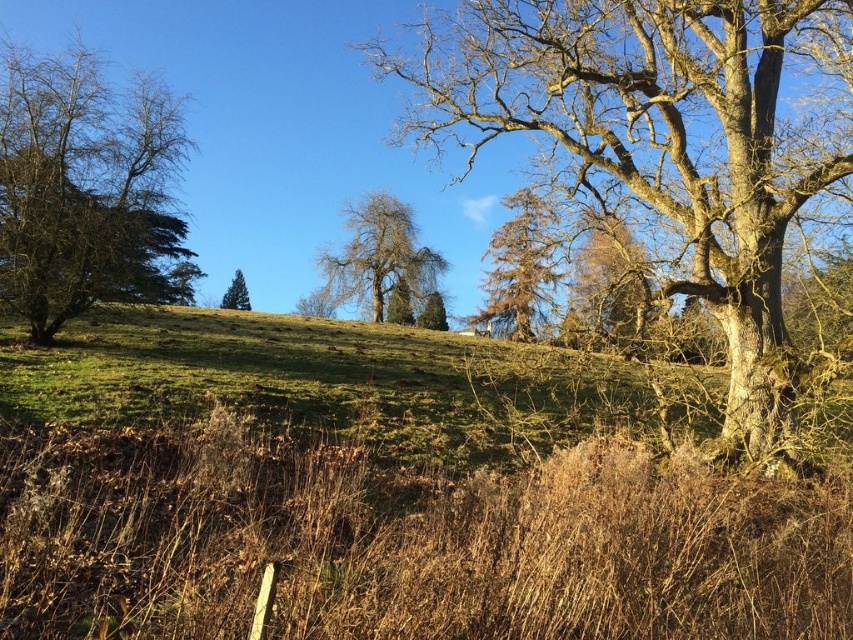
Question: Which object appears closest to the camera in this image?

Choices:
 (A) green matte tree at upper left
 (B) brown rough tree at center
 (C) green leafy tree at left
 (D) green matte evergreen tree at center

Answer: (C)

Question: Is brown rough tree at center below green matte evergreen tree at center?

Choices:
 (A) yes
 (B) no

Answer: (B)

Question: In this image, where is green leafy tree at left located relative to brown rough bark tree at center?

Choices:
 (A) above
 (B) below

Answer: (B)

Question: Is brown/scaly tree at center below brown rough tree at center?

Choices:
 (A) no
 (B) yes

Answer: (A)

Question: Which point is closer to the camera taking this photo?

Choices:
 (A) (294, 307)
 (B) (74, 147)
 (C) (230, 292)
 (D) (463, 29)

Answer: (D)

Question: Which of the following is the farthest from the observer?

Choices:
 (A) (102, 109)
 (B) (757, 116)
 (C) (598, 244)

Answer: (C)